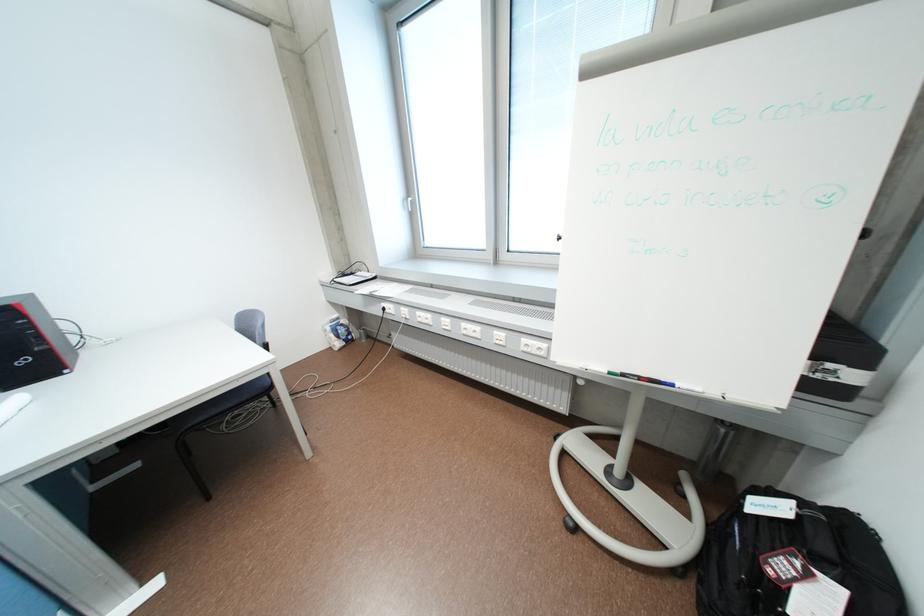
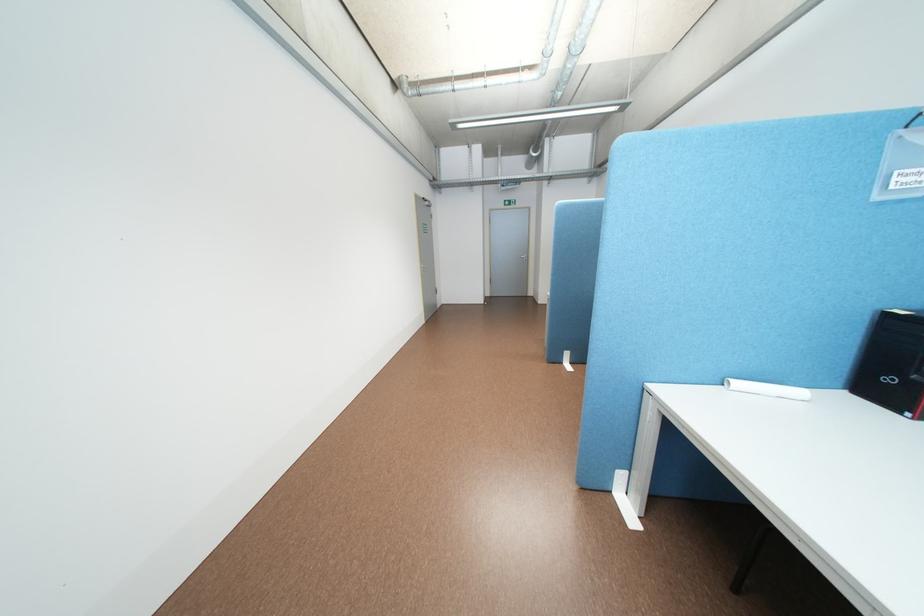
Find the pixel in the second image that matches (34,361) in the first image.

(901, 379)